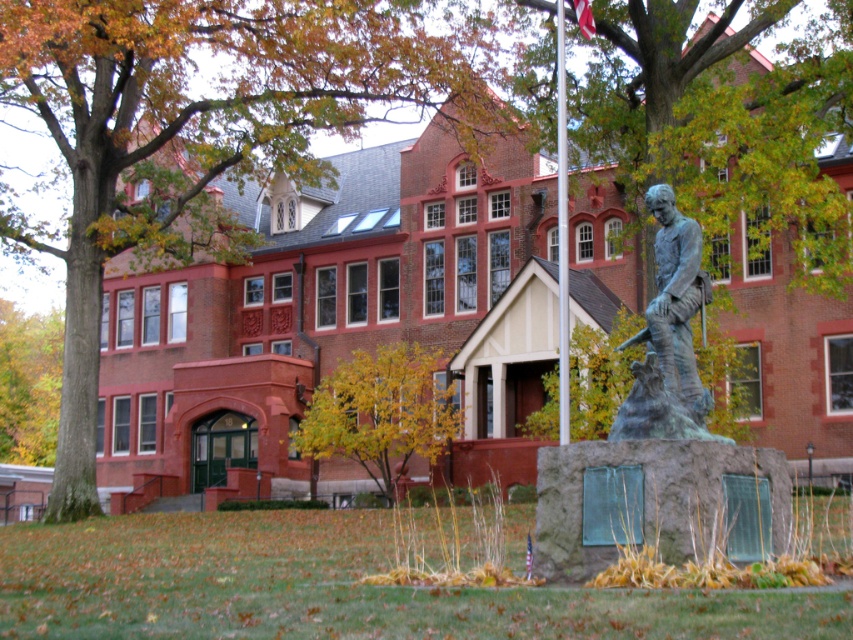
You are a visitor approaching the building and see the bronze statue at center and the metallic flagpole at center. Which object is closer to the entrance with green doors?

The bronze statue at center is positioned on the left side of the metallic flagpole at center, so the bronze statue at center is closer to the entrance with green doors since it is to the left of the flagpole.